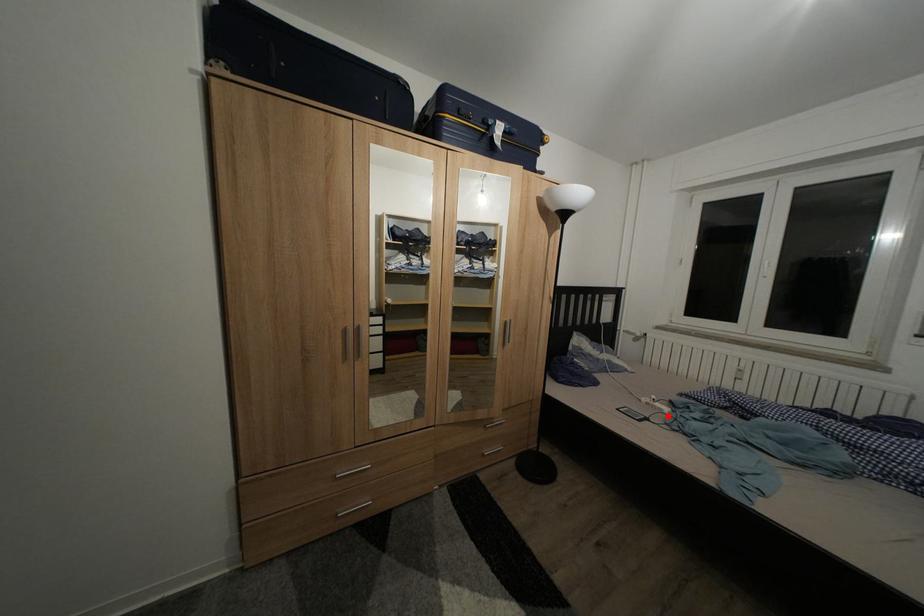
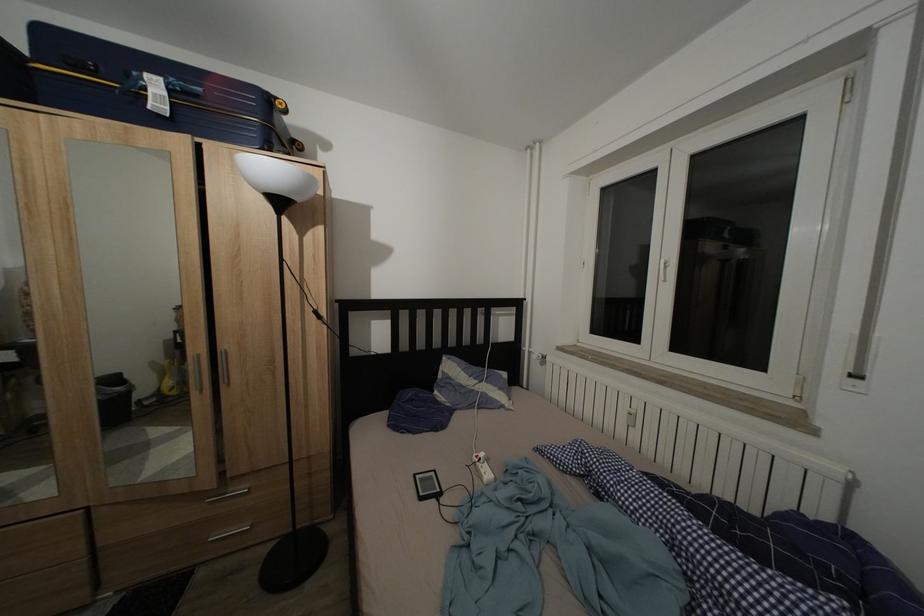
Find the pixel in the second image that matches the highlighted location in the first image.

(488, 483)